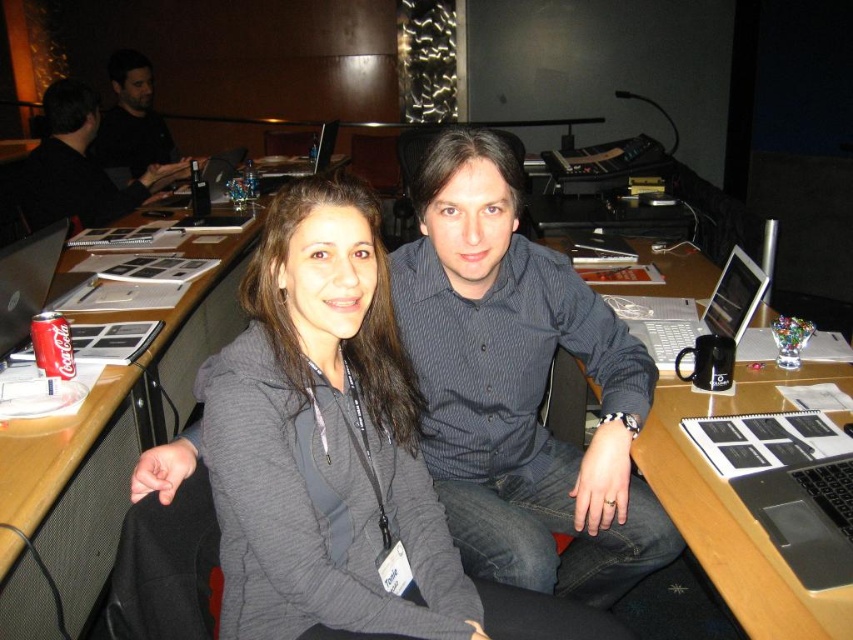
What do you see at coordinates (105, 449) in the screenshot? I see `wooden table at center` at bounding box center [105, 449].

Between point (12, 544) and point (328, 138), which one is positioned in front?

Point (12, 544) is in front.

This screenshot has width=853, height=640. I want to click on wooden table at center, so click(105, 449).

Find the location of a particular element. wooden table at center is located at coordinates (105, 449).

Is point (654, 320) farther from viewer compared to point (726, 284)?

Yes, point (654, 320) is behind point (726, 284).

Between silver metallic laptop at center and matte black laptop at right, which one has less height?

With less height is matte black laptop at right.

Which is in front, point (711, 324) or point (746, 275)?

Point (746, 275)

I want to click on silver metallic laptop at center, so click(x=703, y=310).

The width and height of the screenshot is (853, 640). Describe the element at coordinates (737, 504) in the screenshot. I see `black plastic laptop at center` at that location.

Which is in front, point (792, 618) or point (74, 92)?

Point (792, 618)

Is point (674, 442) less distant than point (39, 195)?

Yes, it is in front of point (39, 195).

This screenshot has width=853, height=640. I want to click on black plastic laptop at center, so click(737, 504).